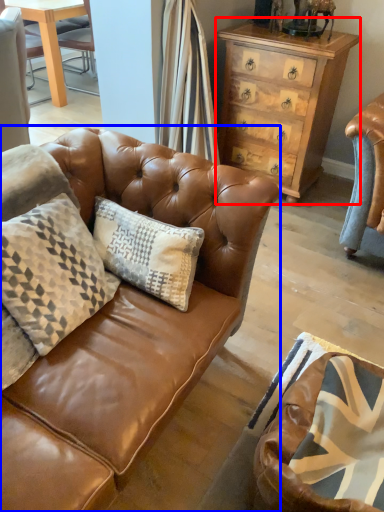
Question: Which object is closer to the camera taking this photo, chest of drawers (highlighted by a red box) or studio couch (highlighted by a blue box)?

Choices:
 (A) chest of drawers
 (B) studio couch

Answer: (B)